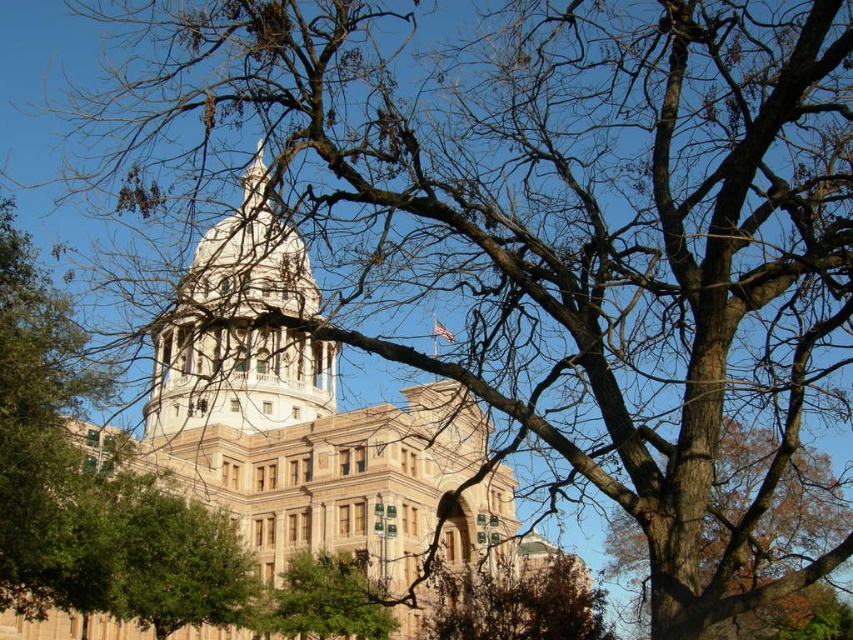
Is brown rough bark tree at center right to the right of brown textured tree at lower center from the viewer's perspective?

Yes, brown rough bark tree at center right is to the right of brown textured tree at lower center.

Can you confirm if brown rough bark tree at center right is smaller than brown textured tree at lower center?

Actually, brown rough bark tree at center right might be larger than brown textured tree at lower center.

Between point (785, 570) and point (454, 627), which one is positioned in front?

Point (454, 627) is more forward.

Locate an element on the screen. brown rough bark tree at center right is located at coordinates (795, 522).

Does beige stone tower at center have a greater height compared to green leafy tree at center?

Yes.

You are a GUI agent. You are given a task and a screenshot of the screen. Output one action in this format:
    pyautogui.click(x=<x>, y=<y>)
    Task: Click on the beige stone tower at center
    This screenshot has width=853, height=640.
    Given the screenshot: What is the action you would take?
    pyautogui.click(x=305, y=448)

Is point (254, 538) positioned after point (299, 355)?

No.

Who is lower down, beige stone tower at center or light brown stone bell tower at center?

beige stone tower at center is below.

The height and width of the screenshot is (640, 853). What are the coordinates of `beige stone tower at center` in the screenshot? It's located at (305, 448).